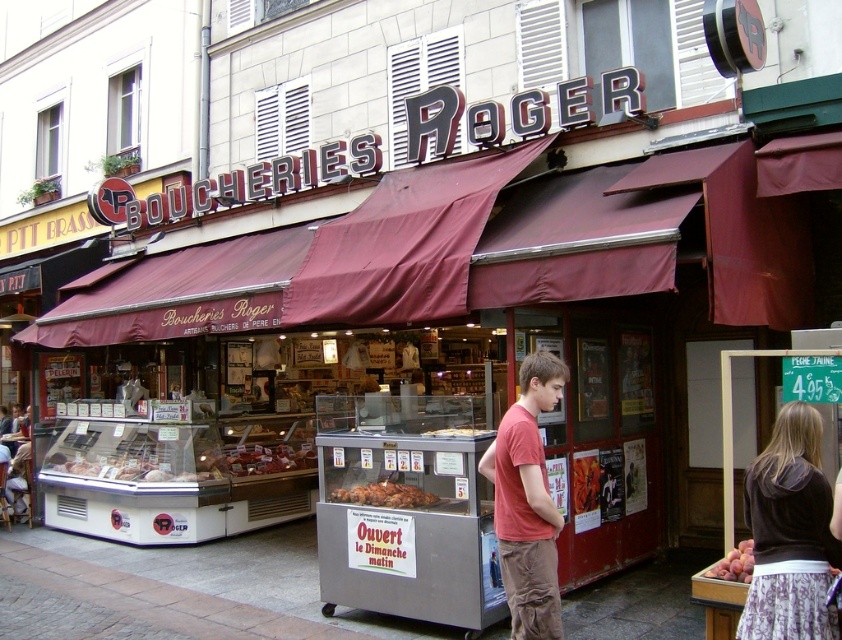
Who is higher up, velvet brown hoodie at center right or matte plastic tray at center?

Positioned higher is matte plastic tray at center.

Who is more forward, (753, 536) or (467, 432)?

Positioned in front is point (753, 536).

Image resolution: width=842 pixels, height=640 pixels. What are the coordinates of `velvet brown hoodie at center right` in the screenshot? It's located at (789, 532).

In the scene shown: Who is lower down, velvet brown hoodie at center right or golden brown croissant at center?

golden brown croissant at center is lower down.

Which is more to the right, velvet brown hoodie at center right or golden brown croissant at center?

From the viewer's perspective, velvet brown hoodie at center right appears more on the right side.

Where is `velvet brown hoodie at center right`? The image size is (842, 640). velvet brown hoodie at center right is located at coordinates (789, 532).

Can you confirm if matte red t-shirt at center is positioned below golden brown croissant at center?

No.

Is matte red t-shirt at center positioned behind golden brown croissant at center?

No, matte red t-shirt at center is in front of golden brown croissant at center.

Does point (515, 490) come closer to viewer compared to point (413, 484)?

Yes, point (515, 490) is closer to viewer.

Locate an element on the screen. This screenshot has height=640, width=842. matte red t-shirt at center is located at coordinates (526, 502).